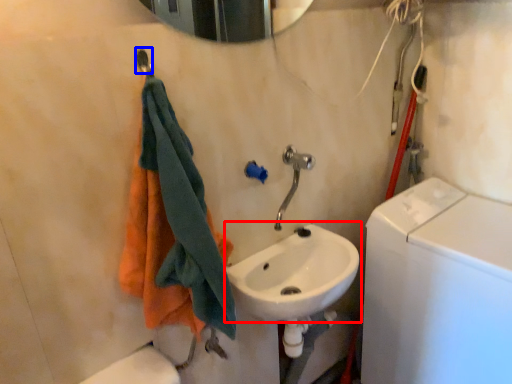
Question: Which object appears farthest to the camera in this image, sink (highlighted by a red box) or shower (highlighted by a blue box)?

Choices:
 (A) sink
 (B) shower

Answer: (A)